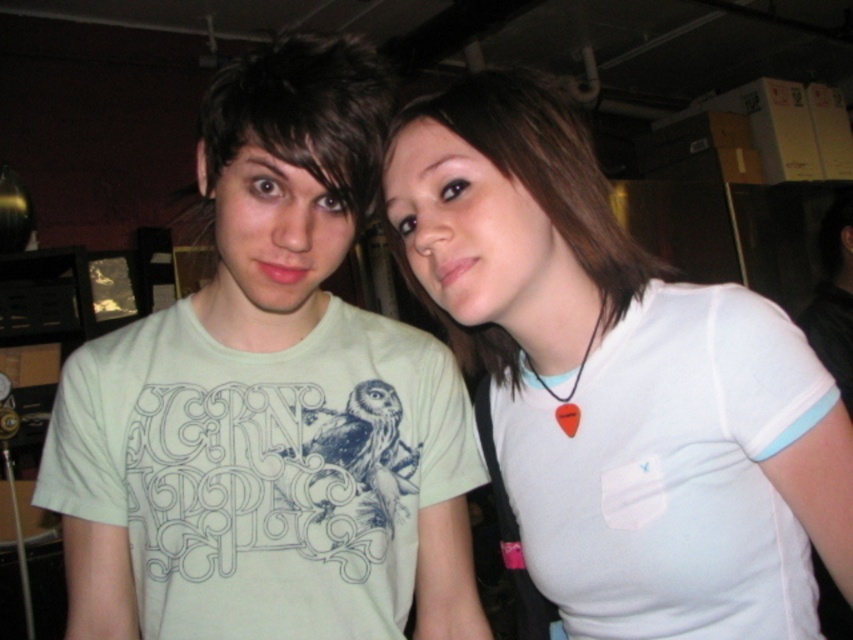
Question: Is light green t-shirt at center positioned before white matte shirt at center?

Choices:
 (A) yes
 (B) no

Answer: (A)

Question: Does light green t-shirt at center have a larger size compared to white matte shirt at center?

Choices:
 (A) no
 (B) yes

Answer: (B)

Question: In this image, where is light green t-shirt at center located relative to white matte shirt at center?

Choices:
 (A) left
 (B) right

Answer: (A)